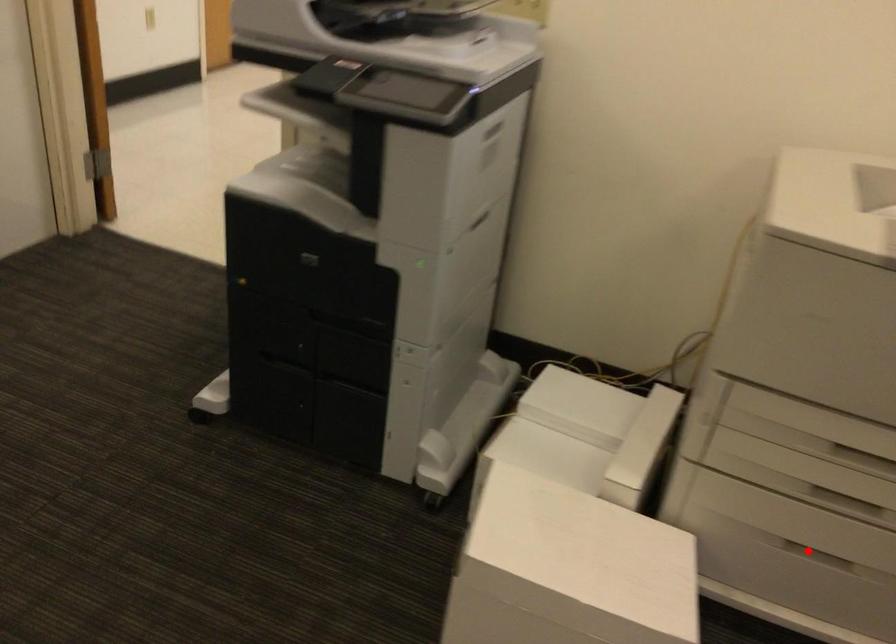
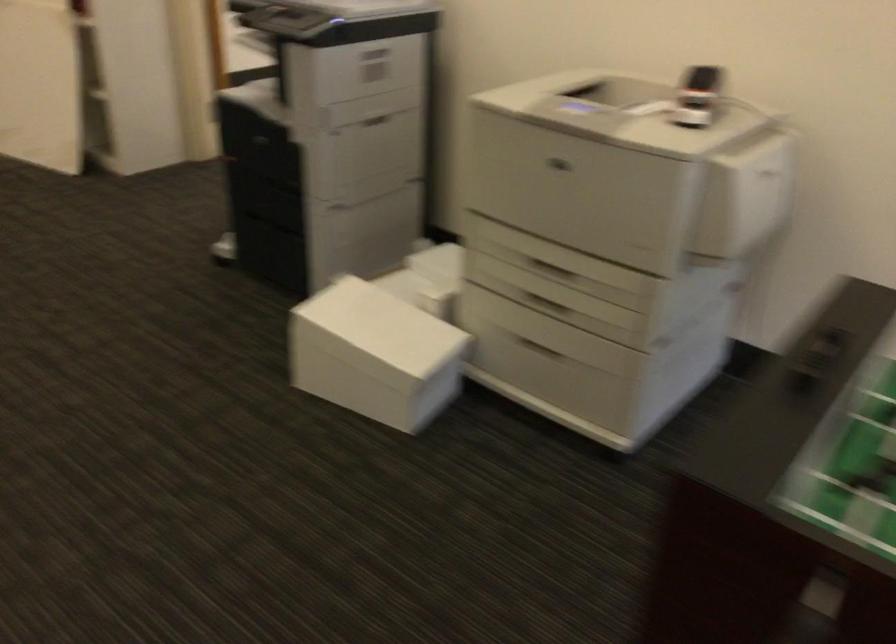
Question: A red point is marked in image1. In image2, is the corresponding 3D point closer to the camera or farther? Reply with the corresponding letter.

Choices:
 (A) The corresponding 3D point is closer.
 (B) The corresponding 3D point is farther.

Answer: (B)